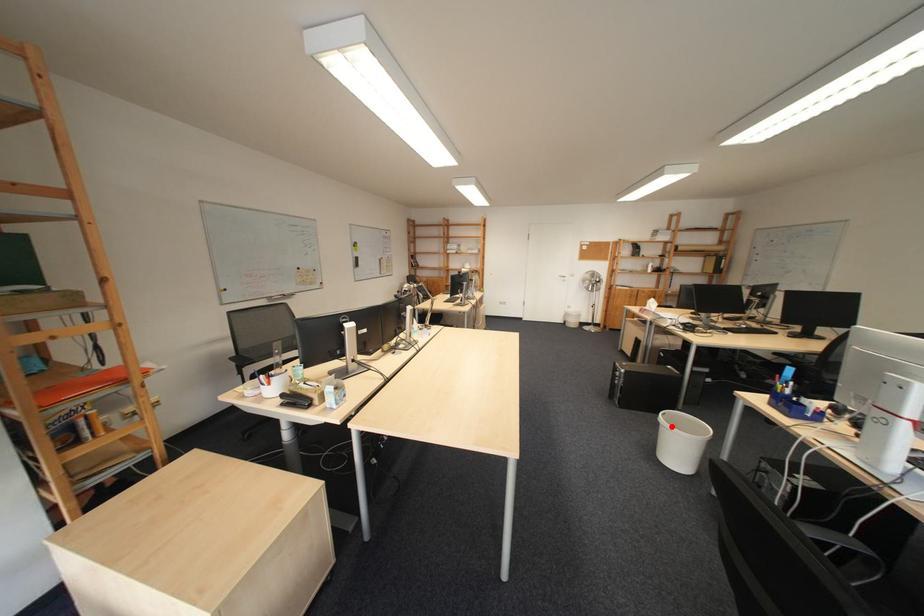
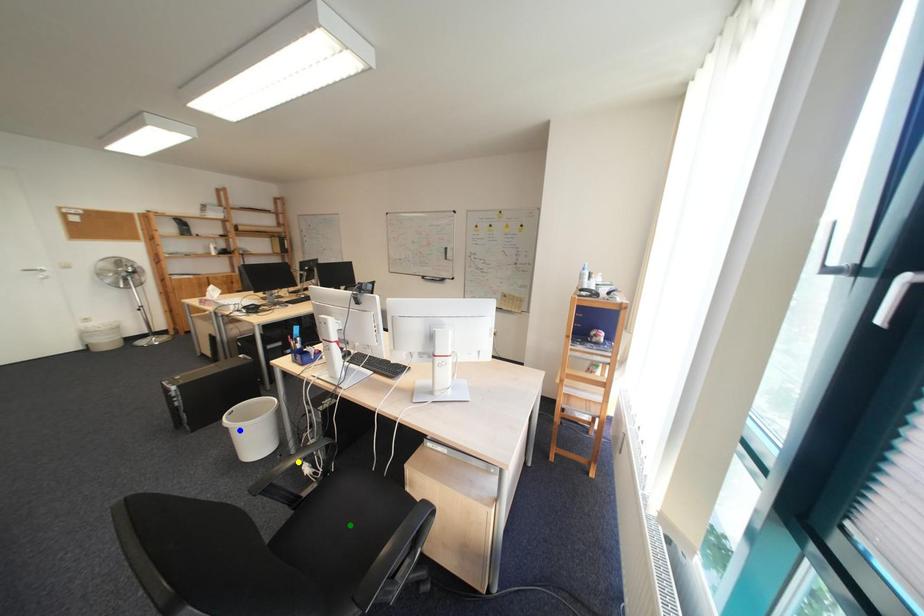
Question: I am providing you with two images of the same scene from different viewpoints. A red point is marked on the first image. You are given multiple points on the second image. Which point in image 2 represents the same 3d spot as the red point in image 1?

Choices:
 (A) blue point
 (B) green point
 (C) yellow point

Answer: (A)